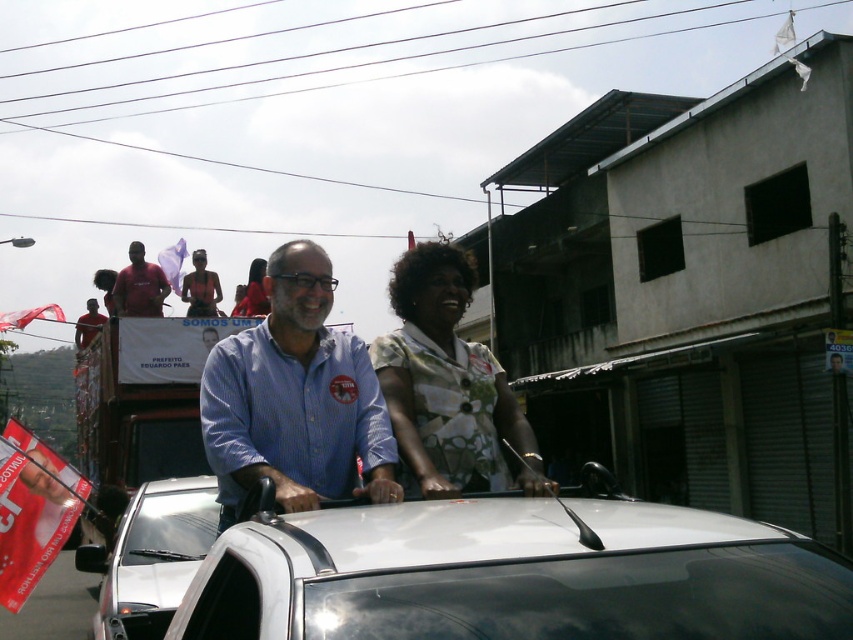
Does white glossy car at center have a larger size compared to matte red shirt at upper left?

Actually, white glossy car at center might be smaller than matte red shirt at upper left.

The height and width of the screenshot is (640, 853). I want to click on white glossy car at center, so click(x=514, y=576).

Find the location of a particular element. white glossy car at center is located at coordinates pos(514,576).

Is silver metallic car at center above matte red shirt at upper left?

No, silver metallic car at center is not above matte red shirt at upper left.

Does silver metallic car at center lie behind matte red shirt at upper left?

No, silver metallic car at center is closer to the viewer.

Is point (144, 496) closer to viewer compared to point (151, 301)?

That is True.

In order to click on silver metallic car at center in this screenshot , I will do `click(151, 556)`.

Can you confirm if floral fabric blouse at center is smaller than matte black shirt at center?

Yes, floral fabric blouse at center is smaller than matte black shirt at center.

Is point (445, 352) more distant than point (213, 288)?

No, it is in front of (213, 288).

Does point (479, 372) come in front of point (202, 285)?

Yes, point (479, 372) is closer to viewer.

Identify the location of floral fabric blouse at center. Image resolution: width=853 pixels, height=640 pixels. (447, 385).